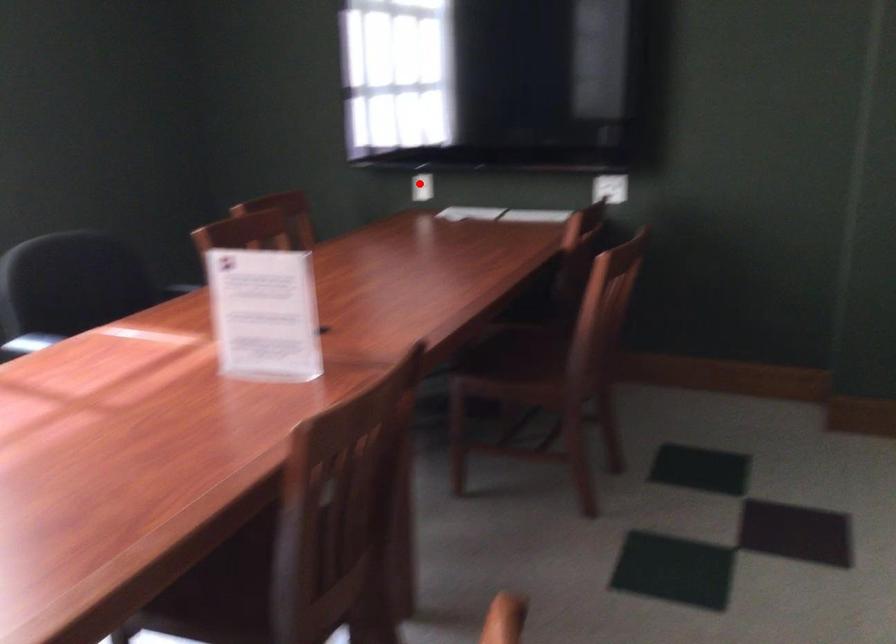
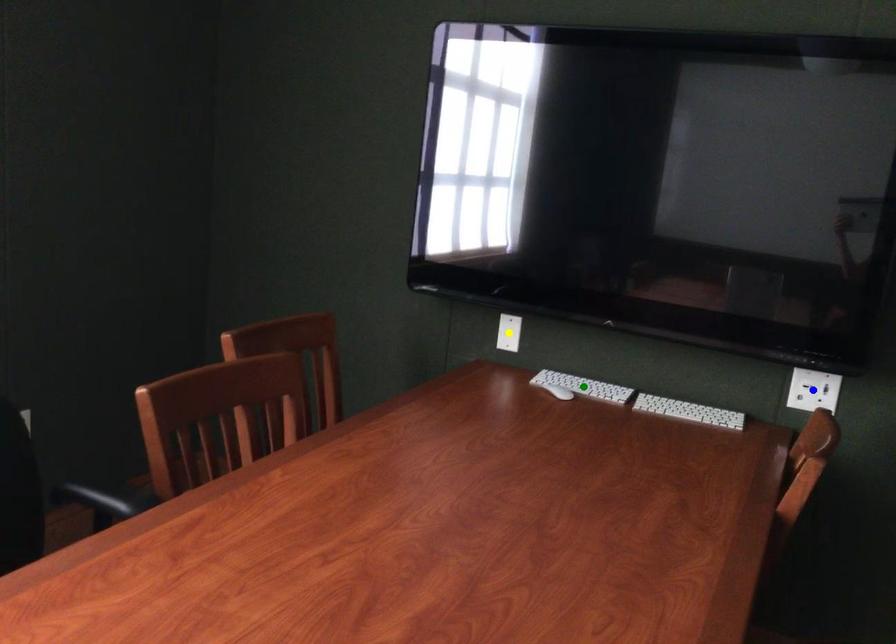
Question: I am providing you with two images of the same scene from different viewpoints. A red point is marked on the first image. You are given multiple points on the second image. Which point in image 2 is actually the same real-world point as the red point in image 1?

Choices:
 (A) blue point
 (B) green point
 (C) yellow point

Answer: (C)